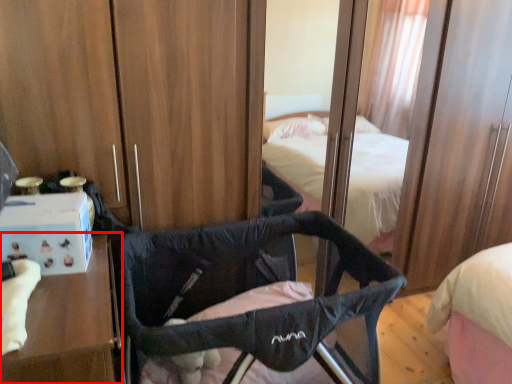
Question: In this image, where is furniture (annotated by the red box) located relative to infant bed?

Choices:
 (A) left
 (B) right

Answer: (A)